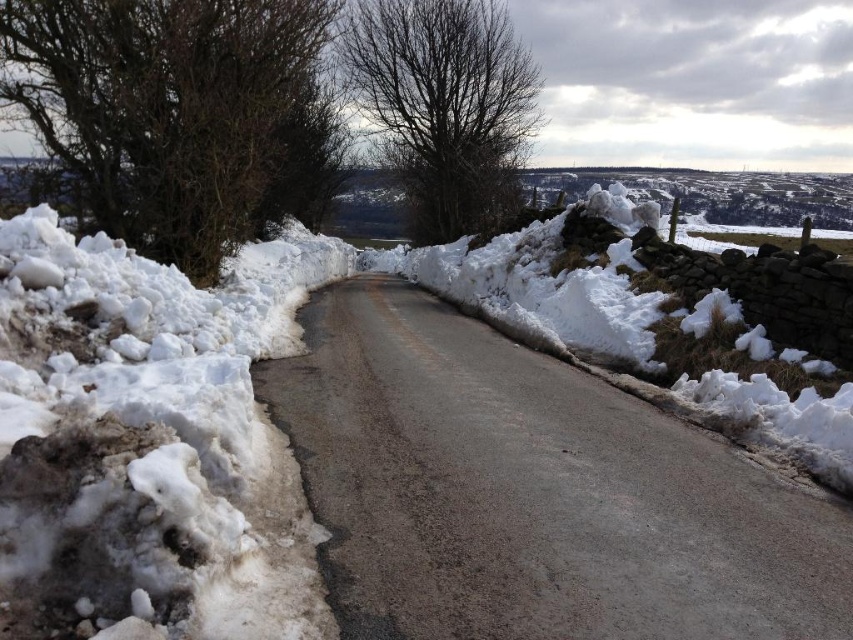
Question: Which object is closer to the camera taking this photo?

Choices:
 (A) bare branches at upper center
 (B) bare branches at left

Answer: (B)

Question: In this image, where is gray asphalt road at center located relative to bare branches at upper center?

Choices:
 (A) left
 (B) right

Answer: (B)

Question: Which point appears closest to the camera in this image?

Choices:
 (A) (399, 32)
 (B) (202, 13)

Answer: (B)

Question: Among these objects, which one is farthest from the camera?

Choices:
 (A) bare branches at left
 (B) bare branches at upper center
 (C) gray asphalt road at center

Answer: (B)

Question: Does bare branches at left lie behind bare branches at upper center?

Choices:
 (A) yes
 (B) no

Answer: (B)

Question: Does bare branches at left have a greater width compared to bare branches at upper center?

Choices:
 (A) yes
 (B) no

Answer: (B)